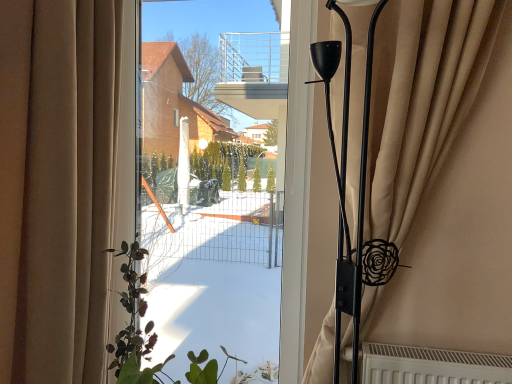
Question: Is beige fabric curtain at left, marked as the 2th curtain in a right-to-left arrangement, to the left or to the right of transparent glass window screen at center in the image?

Choices:
 (A) left
 (B) right

Answer: (A)

Question: From the image's perspective, is beige fabric curtain at left, marked as the 2th curtain in a right-to-left arrangement, above or below transparent glass window screen at center?

Choices:
 (A) below
 (B) above

Answer: (A)

Question: Which object is positioned farthest from the beige fabric curtain at right, which appears as the second curtain when viewed from the left?

Choices:
 (A) transparent glass window screen at center
 (B) green matte plant at left
 (C) beige fabric curtain at left, marked as the 2th curtain in a right-to-left arrangement

Answer: (A)

Question: Which is nearer to the beige fabric curtain at right, which appears as the second curtain when viewed from the left?

Choices:
 (A) green matte plant at left
 (B) transparent glass window screen at center
 (C) beige fabric curtain at left, acting as the 1th curtain starting from the left

Answer: (C)